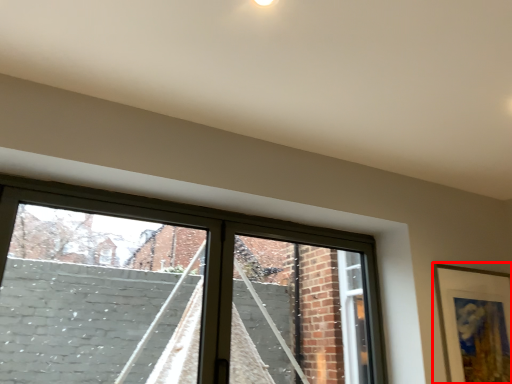
Question: Where is picture frame (annotated by the red box) located in relation to window in the image?

Choices:
 (A) right
 (B) left

Answer: (A)